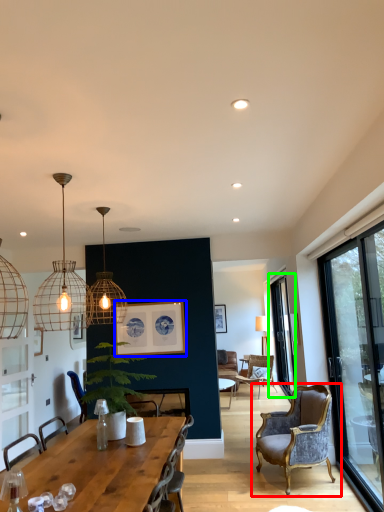
Question: Which is nearer to the chair (highlighted by a red box)? picture frame (highlighted by a blue box) or window (highlighted by a green box).

Choices:
 (A) picture frame
 (B) window

Answer: (B)